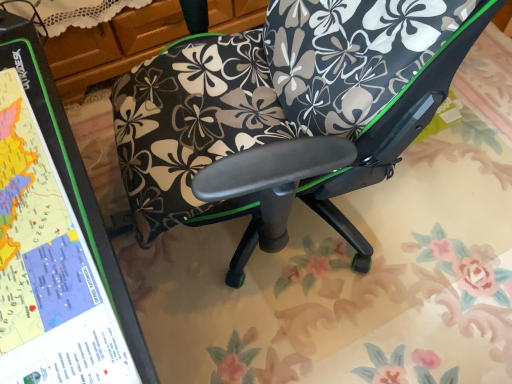
Image resolution: width=512 pixels, height=384 pixels. I want to click on free point above green matte map at left (from a real-world perspective), so click(x=34, y=238).